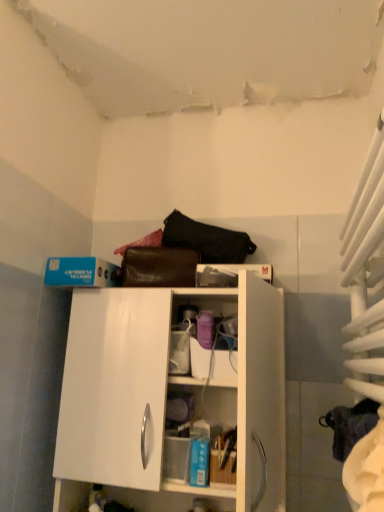
Question: From the image's perspective, would you say black leather handbag at upper center is positioned over white fabric curtain at right?

Choices:
 (A) yes
 (B) no

Answer: (A)

Question: Is black leather handbag at upper center oriented towards white fabric curtain at right?

Choices:
 (A) no
 (B) yes

Answer: (A)

Question: Does black leather handbag at upper center appear on the right side of white fabric curtain at right?

Choices:
 (A) yes
 (B) no

Answer: (B)

Question: Is black leather handbag at upper center wider than white fabric curtain at right?

Choices:
 (A) yes
 (B) no

Answer: (B)

Question: Is black leather handbag at upper center at the left side of white fabric curtain at right?

Choices:
 (A) yes
 (B) no

Answer: (A)

Question: In the image, is white fabric curtain at right on the left side or the right side of black leather handbag at upper center?

Choices:
 (A) left
 (B) right

Answer: (B)

Question: In the image, is white fabric curtain at right positioned in front of or behind black leather handbag at upper center?

Choices:
 (A) front
 (B) behind

Answer: (A)

Question: In terms of width, does white fabric curtain at right look wider or thinner when compared to black leather handbag at upper center?

Choices:
 (A) thin
 (B) wide

Answer: (B)

Question: In terms of size, does white fabric curtain at right appear bigger or smaller than black leather handbag at upper center?

Choices:
 (A) small
 (B) big

Answer: (B)

Question: Is white glossy cabinet at center situated inside black leather handbag at upper center or outside?

Choices:
 (A) inside
 (B) outside

Answer: (B)

Question: In the image, is white glossy cabinet at center positioned in front of or behind black leather handbag at upper center?

Choices:
 (A) front
 (B) behind

Answer: (A)

Question: From the image's perspective, relative to black leather handbag at upper center, is white glossy cabinet at center above or below?

Choices:
 (A) above
 (B) below

Answer: (B)

Question: From a real-world perspective, is white glossy cabinet at center positioned above or below black leather handbag at upper center?

Choices:
 (A) above
 (B) below

Answer: (B)

Question: In terms of height, does white fabric curtain at right look taller or shorter compared to white glossy cabinet at center?

Choices:
 (A) short
 (B) tall

Answer: (B)

Question: Based on their positions, is white fabric curtain at right located to the left or right of white glossy cabinet at center?

Choices:
 (A) left
 (B) right

Answer: (B)